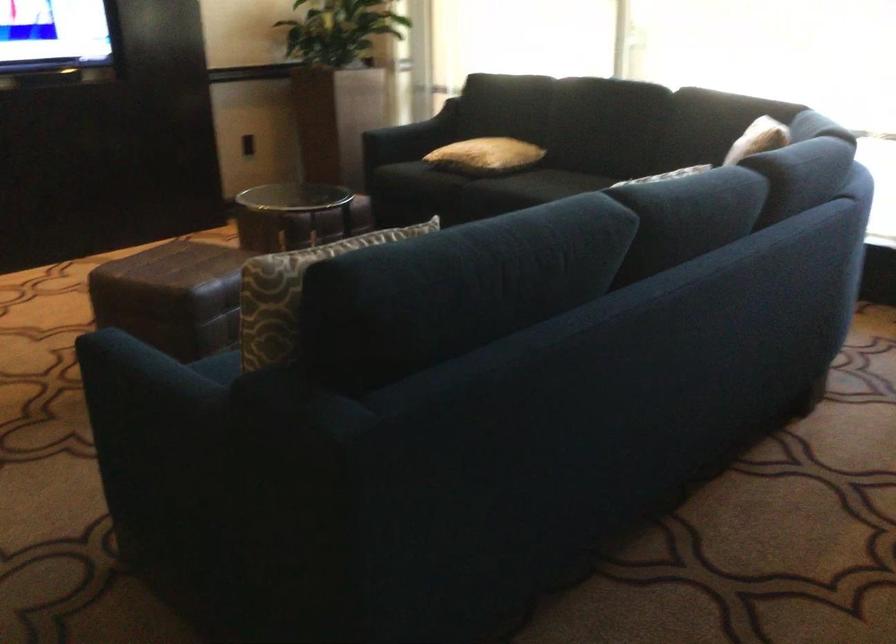
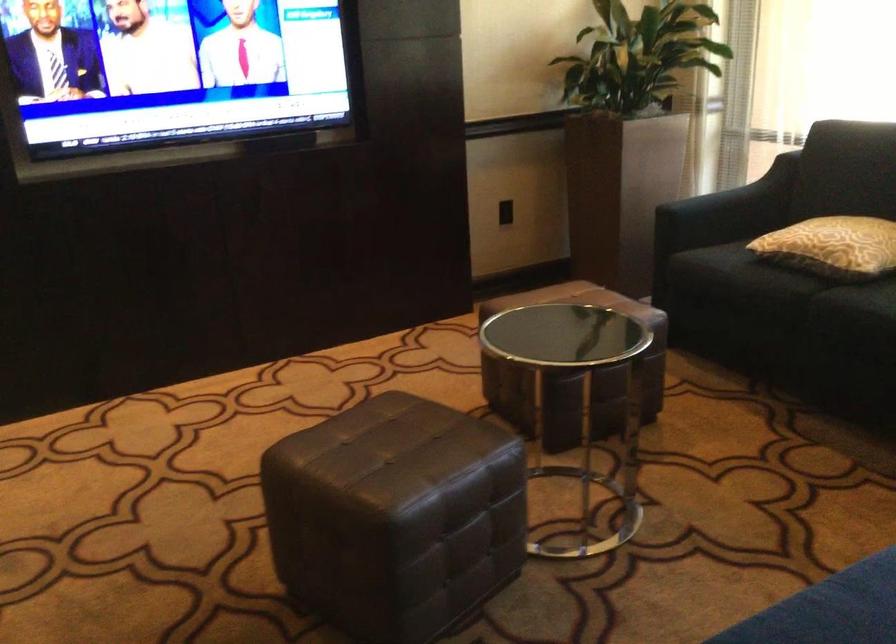
Find the pixel in the second image that matches pixel 476 155 in the first image.

(832, 245)